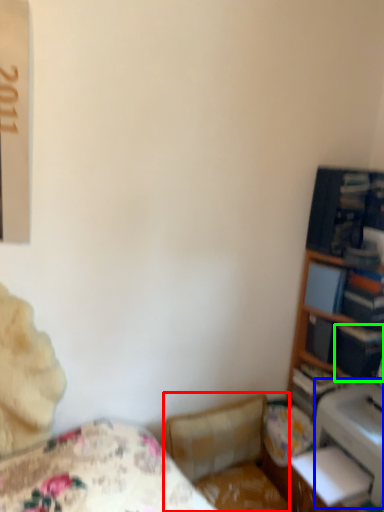
Question: Considering the real-world distances, which object is closest to swivel chair (highlighted by a red box)? printer (highlighted by a blue box) or paperback book (highlighted by a green box).

Choices:
 (A) printer
 (B) paperback book

Answer: (A)